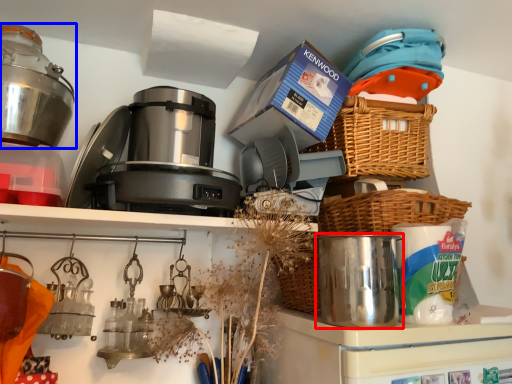
Question: Which object is further to the camera taking this photo, appliance (highlighted by a red box) or kitchen appliance (highlighted by a blue box)?

Choices:
 (A) appliance
 (B) kitchen appliance

Answer: (B)